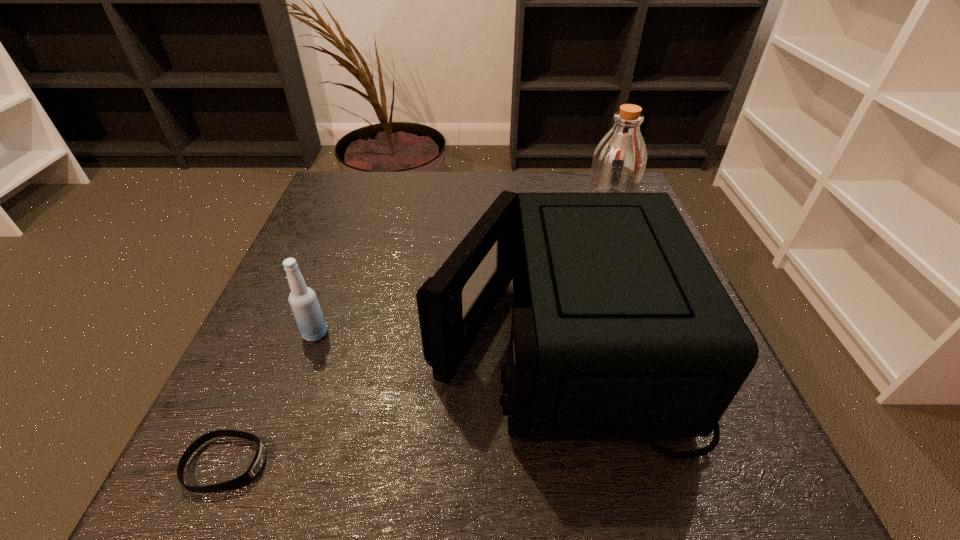
Locate an element on the screen. The height and width of the screenshot is (540, 960). object that is at the far right corner is located at coordinates (619, 160).

This screenshot has height=540, width=960. Identify the location of object at the near right corner. (621, 328).

I want to click on free space at the far edge, so click(x=482, y=188).

Where is `vacant position at the near edge of the desktop`? The width and height of the screenshot is (960, 540). vacant position at the near edge of the desktop is located at coordinates (x=543, y=450).

In the image, there is a desktop. In order to click on vacant space at the left edge in this screenshot , I will do `click(340, 262)`.

You are a GUI agent. You are given a task and a screenshot of the screen. Output one action in this format:
    pyautogui.click(x=<x>, y=<y>)
    Task: Click on the free spot at the far left corner of the desktop
    
    Given the screenshot: What is the action you would take?
    pyautogui.click(x=359, y=172)

This screenshot has height=540, width=960. What are the coordinates of `free space at the far right corner of the desktop` in the screenshot? It's located at pos(581,180).

In the image, there is a desktop. Identify the location of vacant space at the near right corner. (667, 492).

Locate an element on the screen. free area in between the shortest object and the left bottle is located at coordinates (271, 399).

Locate an element on the screen. The image size is (960, 540). empty space that is in between the wristband and the microwave oven is located at coordinates (393, 400).